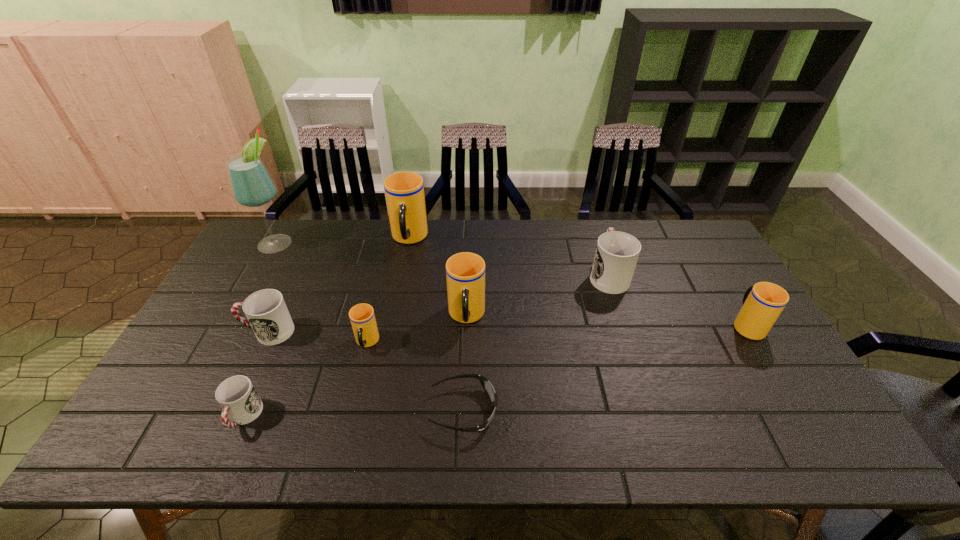
Locate an element on the screen. alcohol present at the left edge is located at coordinates (252, 186).

This screenshot has height=540, width=960. Find the location of `cup present at the left edge`. cup present at the left edge is located at coordinates (266, 311).

Identify the location of object that is at the right edge. Image resolution: width=960 pixels, height=540 pixels. (762, 303).

Locate an element on the screen. object that is at the far left corner is located at coordinates (252, 186).

Where is `vacant space at the far edge of the desktop`? Image resolution: width=960 pixels, height=540 pixels. vacant space at the far edge of the desktop is located at coordinates (459, 228).

In the image, there is a desktop. Identify the location of free space at the near edge. Image resolution: width=960 pixels, height=540 pixels. (693, 447).

Find the location of a particular element. vacant region at the right edge is located at coordinates (758, 357).

Find the location of a particular element. This screenshot has width=960, height=540. vacant space at the far left corner of the desktop is located at coordinates (285, 251).

In the image, there is a desktop. Where is `vacant space at the near left corner`? The width and height of the screenshot is (960, 540). vacant space at the near left corner is located at coordinates (161, 437).

Find the location of a particular element. vacant space at the near right corner of the desktop is located at coordinates (815, 429).